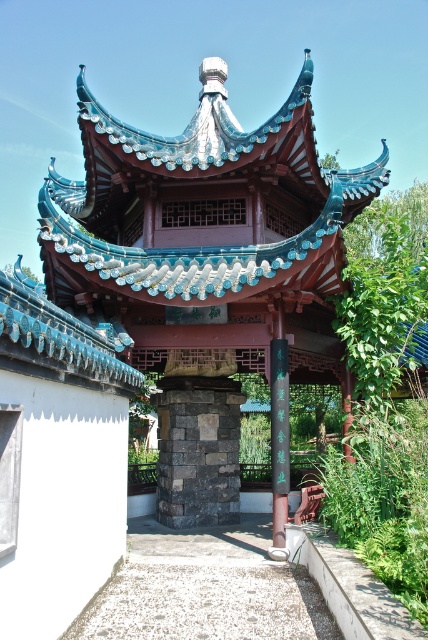
Question: Does dark gray stone pillar at center have a larger size compared to black polished wood pole at center?

Choices:
 (A) yes
 (B) no

Answer: (A)

Question: Which of the following is the farthest from the observer?

Choices:
 (A) dark gray stone pillar at center
 (B) black polished wood pole at center

Answer: (A)

Question: Observing the image, what is the correct spatial positioning of dark gray stone pillar at center in reference to black polished wood pole at center?

Choices:
 (A) below
 (B) above

Answer: (A)

Question: Does dark gray stone pillar at center appear on the left side of black polished wood pole at center?

Choices:
 (A) yes
 (B) no

Answer: (A)

Question: Among these objects, which one is nearest to the camera?

Choices:
 (A) dark gray stone pillar at center
 (B) black polished wood pole at center

Answer: (B)